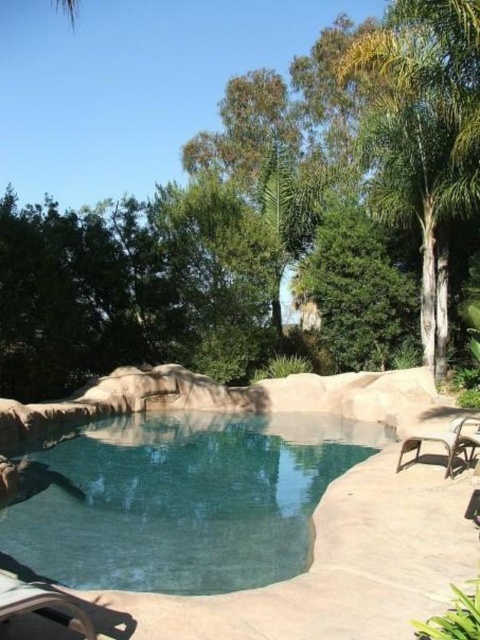
You are planning to place a small potted plant between the clear blue water at center and the metallic silver chair at lower left. Based on their heights, which object should the plant be placed closer to?

The clear blue water at center has a lesser height compared to the metallic silver chair at lower left, so the plant should be placed closer to the clear blue water at center to ensure proper visibility and balance.

You are standing on the deck and want to place a new plant pot between the clear blue water at center and the metallic silver chair at lower left. Based on their positions, which object should the plant pot be closer to?

The clear blue water at center is positioned on the left side of metallic silver chair at lower left. Therefore, the plant pot should be placed closer to the clear blue water at center to maintain the spatial arrangement between them.

You are standing on the deck and want to place a small potted plant between the clear blue water at center and the brown woven chair at lower right. Based on their positions, which object should the plant be closer to?

The clear blue water at center is to the left of the brown woven chair at lower right, so the plant should be placed closer to the brown woven chair at lower right to maintain symmetry between the two objects.